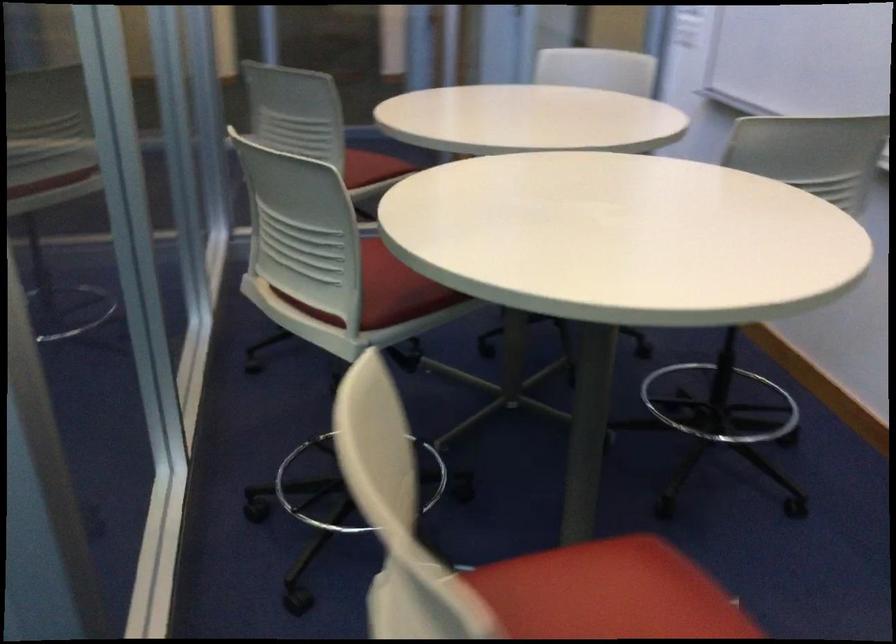
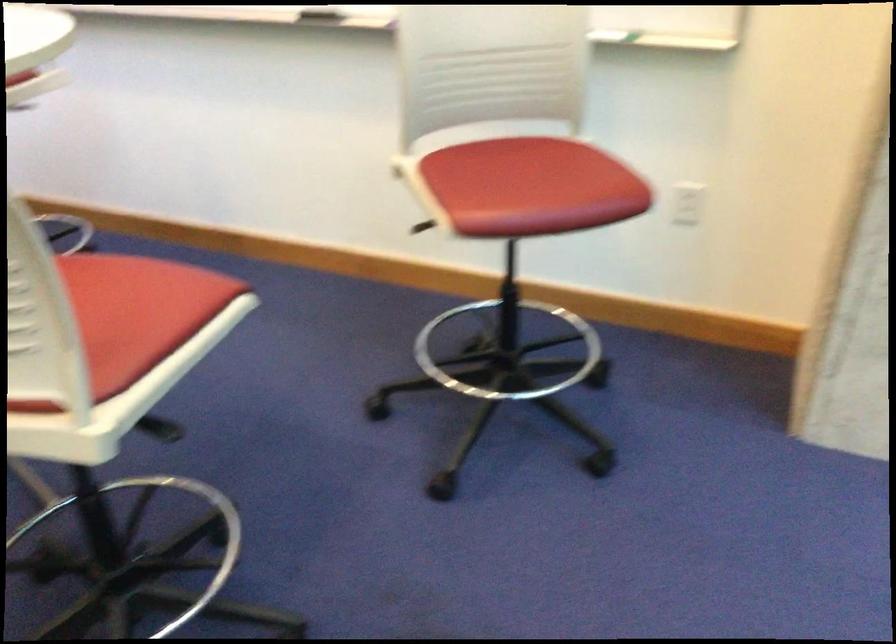
Question: The images are taken continuously from a first-person perspective. In which direction is your viewpoint rotating?

Choices:
 (A) Left
 (B) Right
 (C) Up
 (D) Down

Answer: (B)